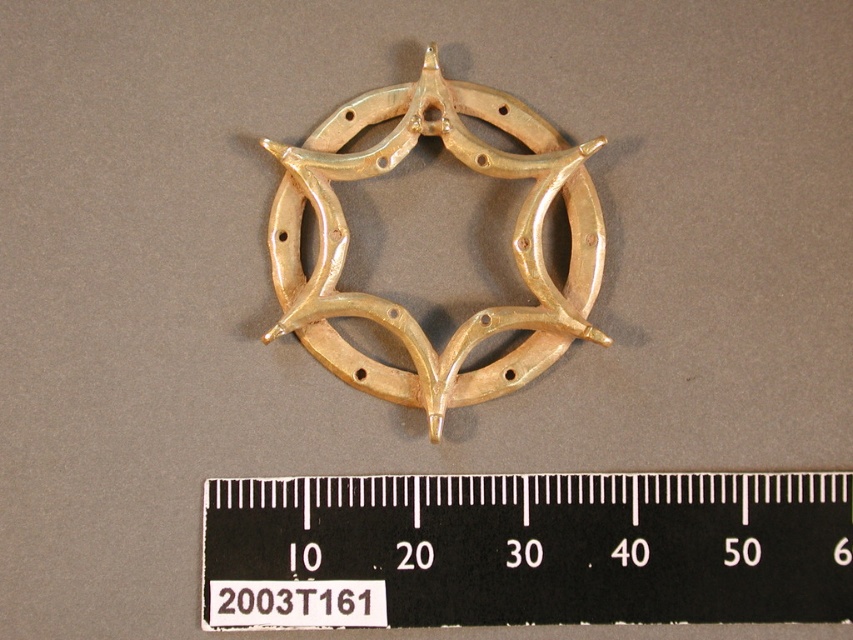
Between black plastic ruler at center and gold metallic horseshoe at center, which one is positioned lower?

black plastic ruler at center is below.

Can you confirm if black plastic ruler at center is wider than gold metallic horseshoe at center?

Correct, the width of black plastic ruler at center exceeds that of gold metallic horseshoe at center.

Which is in front, point (790, 540) or point (524, 122)?

Point (790, 540) is more forward.

Where is `black plastic ruler at center`? The width and height of the screenshot is (853, 640). black plastic ruler at center is located at coordinates (525, 548).